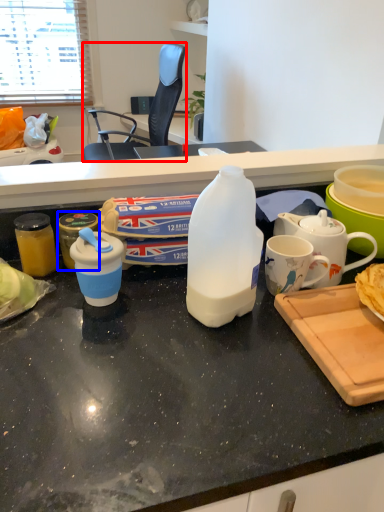
Question: Which point is closer to the camera, chair (highlighted by a red box) or kitchen appliance (highlighted by a blue box)?

Choices:
 (A) chair
 (B) kitchen appliance

Answer: (B)